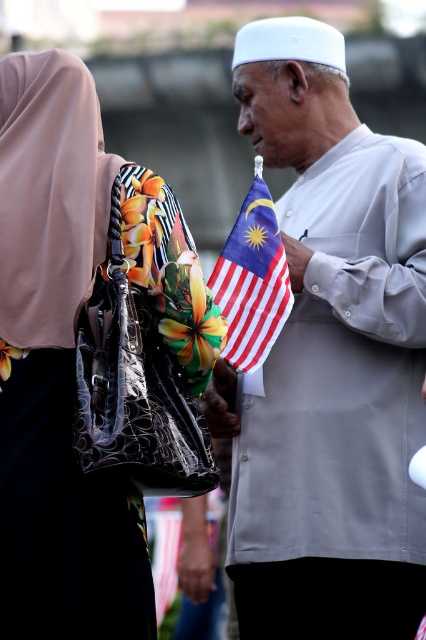
You are a photographer taking a picture of the light gray cotton shirt at center and the leather handbag at center. Which object should you focus on first if you want to ensure both are in frame and the taller one is properly centered?

You should focus on the light gray cotton shirt at center first since it has a greater height compared to the leather handbag at center, ensuring it is properly centered in the frame.

You are a photographer at a formal event and need to capture both the leather handbag at center and the polyester Malaysian flag at center in a single frame. Given their sizes, which object should you focus on to ensure both are clearly visible without zooming in or out?

The leather handbag at center is larger in size than the polyester Malaysian flag at center, so focusing on the leather handbag at center would allow the flag to appear smaller but still visible in the frame without needing to adjust the zoom.

You are attending a formal event and need to locate the light gray cotton shirt at center and the leather handbag at center. From the perspective of someone standing in front of the scene, which object is positioned to the right?

The light gray cotton shirt at center is to the right of the leather handbag at center.